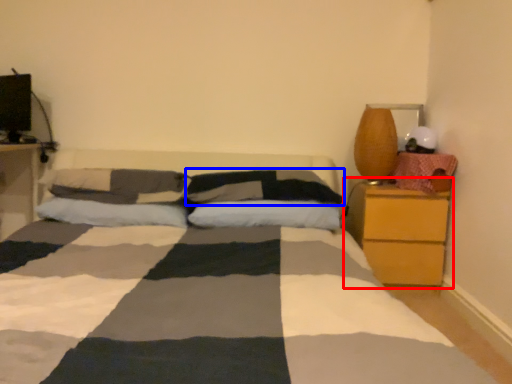
Question: Which object is closer to the camera taking this photo, nightstand (highlighted by a red box) or pillow (highlighted by a blue box)?

Choices:
 (A) nightstand
 (B) pillow

Answer: (B)